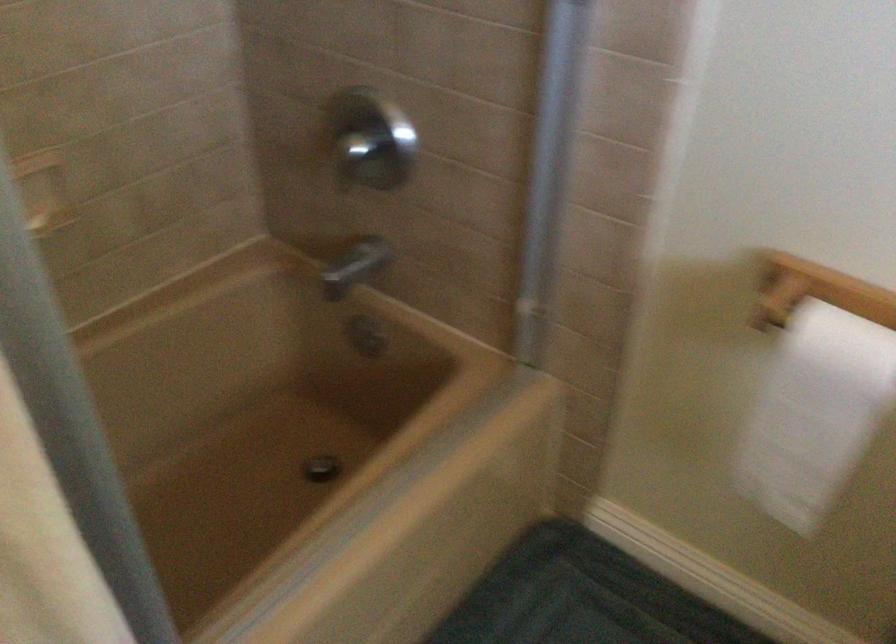
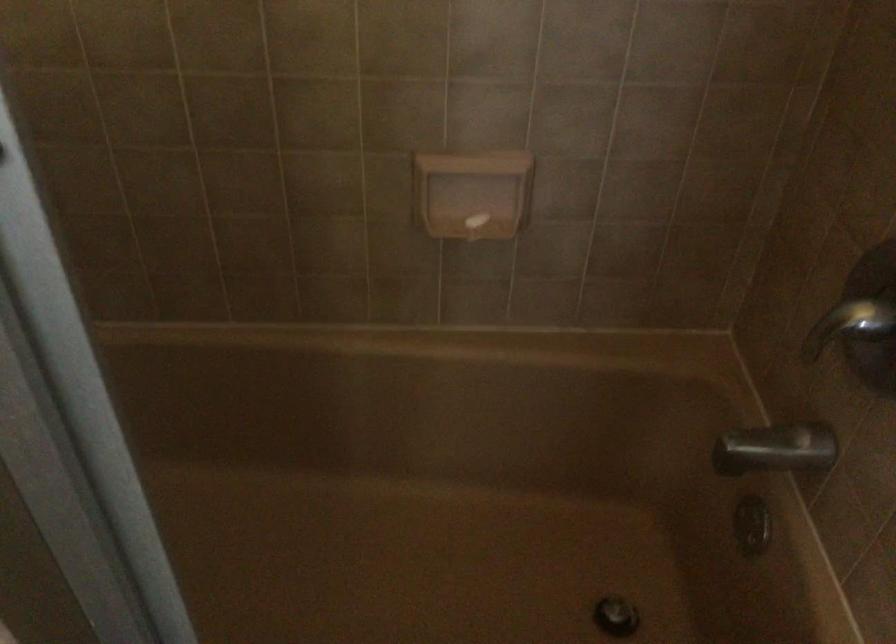
Locate, in the second image, the point that corresponds to point 357,156 in the first image.

(849, 325)